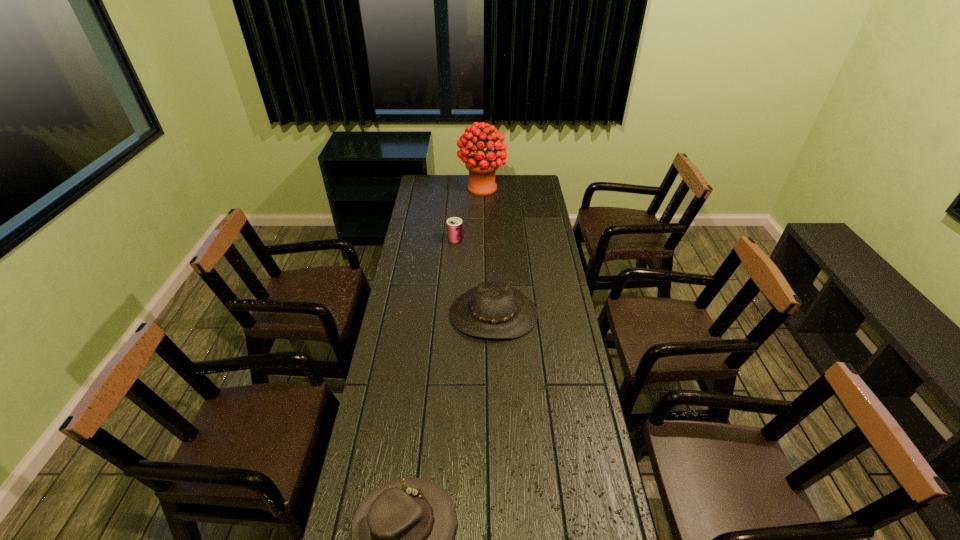
At what (x,y) coordinates should I click in order to perform the action: click on the farthest object. Please return your answer as a coordinate pair (x, y). The image size is (960, 540). Looking at the image, I should click on (482, 166).

The width and height of the screenshot is (960, 540). In order to click on bouquet in this screenshot , I will do `click(482, 166)`.

This screenshot has width=960, height=540. I want to click on the farther hat, so click(495, 310).

At what (x,y) coordinates should I click in order to perform the action: click on the taller hat. Please return your answer as a coordinate pair (x, y). This screenshot has height=540, width=960. Looking at the image, I should click on (495, 310).

Identify the location of can. This screenshot has width=960, height=540. (454, 225).

The width and height of the screenshot is (960, 540). I want to click on vacant space situated on the left of the tallest object, so click(x=434, y=188).

Where is `vacant space located 0.290m on the front-facing side of the taller hat`? vacant space located 0.290m on the front-facing side of the taller hat is located at coordinates click(497, 411).

At what (x,y) coordinates should I click in order to perform the action: click on vacant space located 0.190m on the front of the third nearest object. Please return your answer as a coordinate pair (x, y). Image resolution: width=960 pixels, height=540 pixels. Looking at the image, I should click on tap(453, 271).

What are the coordinates of `object situated at the far edge` in the screenshot? It's located at (482, 166).

Locate an element on the screen. The image size is (960, 540). object at the right edge is located at coordinates (495, 310).